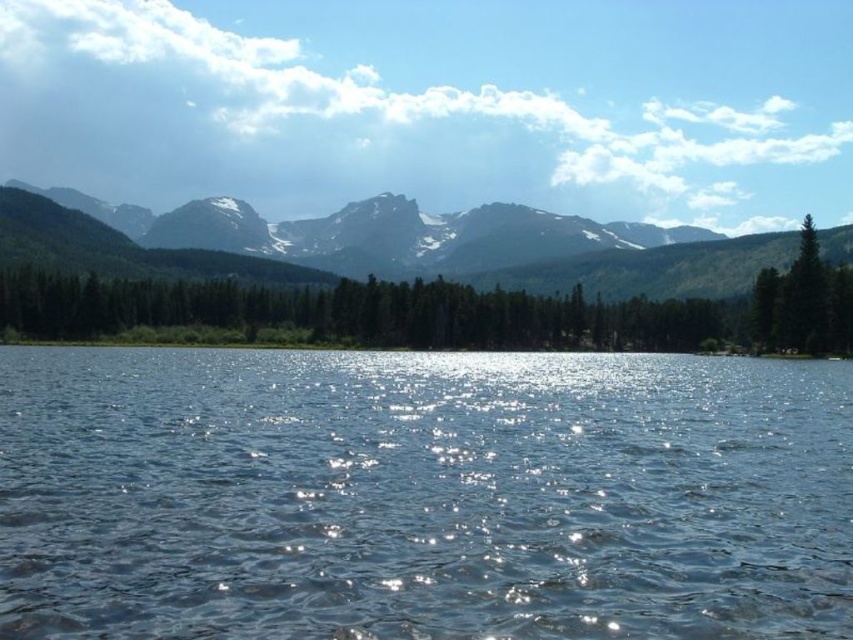
Can you confirm if green matte trees at center is positioned to the right of green matte tree at right?

No, green matte trees at center is not to the right of green matte tree at right.

Which is in front, point (590, 310) or point (825, 332)?

Positioned in front is point (825, 332).

Identify the location of green matte trees at center. point(349,314).

Is point (35, 564) closer to viewer compared to point (804, 218)?

Yes, point (35, 564) is closer to viewer.

Which is above, clear water at center or green matte tree at right?

green matte tree at right is above.

Is point (732, 388) closer to viewer compared to point (766, 276)?

Yes, point (732, 388) is closer to viewer.

The width and height of the screenshot is (853, 640). In order to click on clear water at center in this screenshot , I will do `click(422, 496)`.

Does clear water at center have a lesser width compared to sandy brown rock formation at upper center?

Indeed, clear water at center has a lesser width compared to sandy brown rock formation at upper center.

Is point (512, 372) positioned before point (476, 268)?

Yes, point (512, 372) is in front of point (476, 268).

Describe the element at coordinates (422, 496) in the screenshot. The width and height of the screenshot is (853, 640). I see `clear water at center` at that location.

You are a GUI agent. You are given a task and a screenshot of the screen. Output one action in this format:
    pyautogui.click(x=<x>, y=<y>)
    Task: Click on the clear water at center
    Image resolution: width=853 pixels, height=640 pixels.
    Given the screenshot: What is the action you would take?
    pyautogui.click(x=422, y=496)